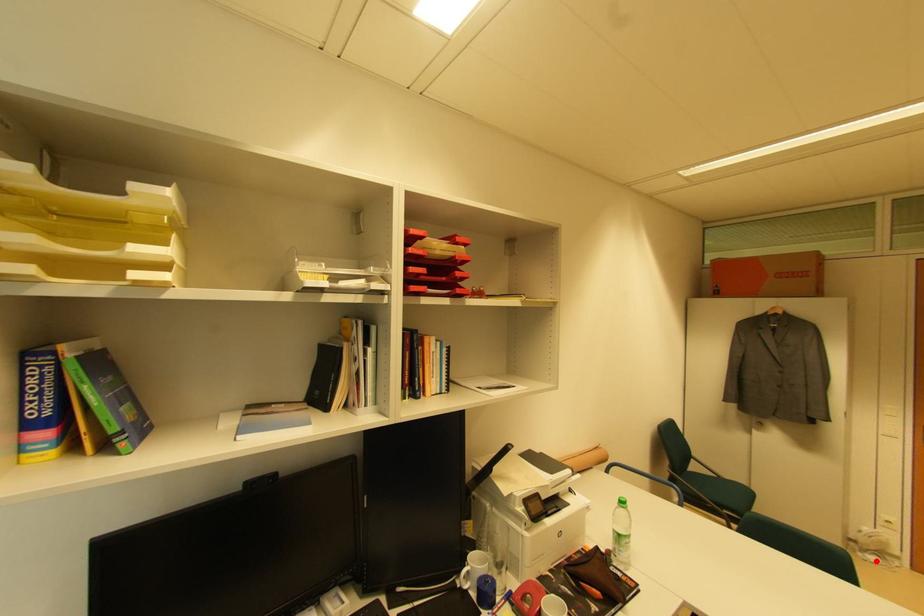
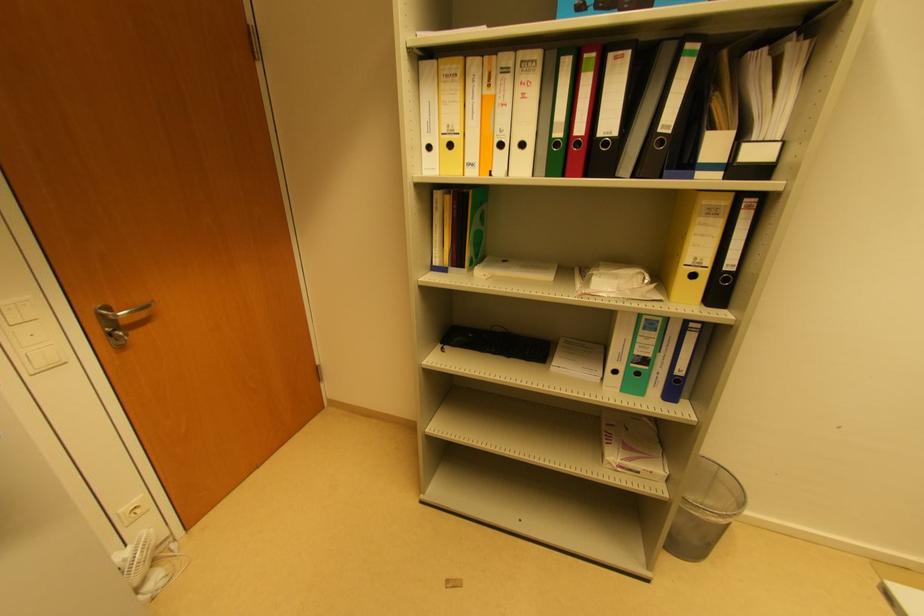
In the second image, find the point that corresponds to the highlighted location in the first image.

(157, 580)